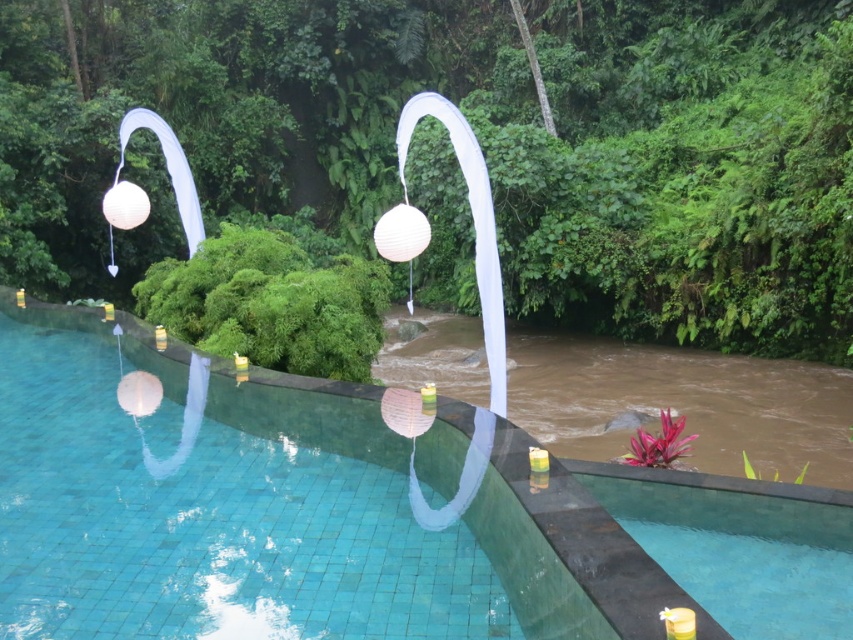
Question: Can you confirm if green leafy tree at upper center is thinner than transparent glass pool at center?

Choices:
 (A) no
 (B) yes

Answer: (A)

Question: Considering the relative positions of green leafy tree at upper center and transparent glass pool at center in the image provided, where is green leafy tree at upper center located with respect to transparent glass pool at center?

Choices:
 (A) left
 (B) right

Answer: (B)

Question: Among these points, which one is farthest from the camera?

Choices:
 (A) (19, 451)
 (B) (531, 120)

Answer: (B)

Question: Which of the following is the closest to the observer?

Choices:
 (A) (258, 573)
 (B) (167, 35)

Answer: (A)

Question: Does green leafy tree at upper center appear on the right side of transparent glass pool at center?

Choices:
 (A) yes
 (B) no

Answer: (A)

Question: Among these objects, which one is farthest from the camera?

Choices:
 (A) green leafy tree at upper center
 (B) transparent glass pool at center

Answer: (A)